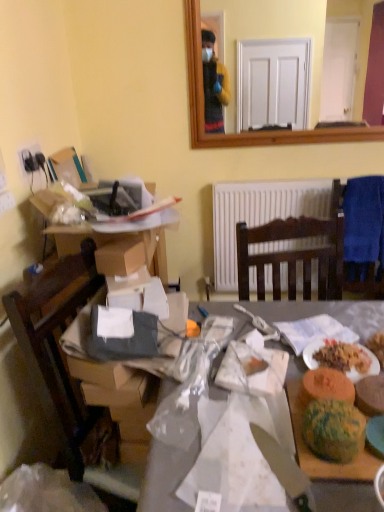
The height and width of the screenshot is (512, 384). What do you see at coordinates (285, 470) in the screenshot?
I see `silver metallic knife at center` at bounding box center [285, 470].

You are a GUI agent. You are given a task and a screenshot of the screen. Output one action in this format:
    pyautogui.click(x=<x>, y=<y>)
    Task: Click on the cardboard box at left, placed as the first desk when sorted from left to right
    Image resolution: width=384 pixels, height=512 pixels.
    Given the screenshot: What is the action you would take?
    point(116,247)

From the image's perspective, is white paper plate at lower right positioned above or below translucent plastic bag at center, acting as the second desk starting from the top?

white paper plate at lower right is situated higher than translucent plastic bag at center, acting as the second desk starting from the top, in the image.

Is point (318, 365) closer or farther from the camera than point (175, 502)?

Point (318, 365) is positioned farther from the camera compared to point (175, 502).

Visually, is white paper plate at lower right positioned to the left or to the right of translucent plastic bag at center, acting as the second desk starting from the top?

Clearly, white paper plate at lower right is on the right of translucent plastic bag at center, acting as the second desk starting from the top, in the image.

From a real-world perspective, is white paper plate at lower right on top of translucent plastic bag at center, acting as the second desk starting from the top?

Yes, from a real-world perspective, white paper plate at lower right is over translucent plastic bag at center, acting as the second desk starting from the top

Does point (345, 379) come behind point (219, 354)?

That is False.

Is green textured bread at lower right, the 1th food when ordered from left to right, shorter than translucent plastic bag at center, acting as the second desk starting from the top?

Yes, green textured bread at lower right, the 1th food when ordered from left to right, is shorter than translucent plastic bag at center, acting as the second desk starting from the top.

Is green textured bread at lower right, the 1th food when ordered from left to right, wider or thinner than translucent plastic bag at center, which is the 1th desk in right-to-left order?

green textured bread at lower right, the 1th food when ordered from left to right, is thinner than translucent plastic bag at center, which is the 1th desk in right-to-left order.

From the image's perspective, relative to translucent plastic bag at center, acting as the second desk starting from the top, is multicolored plastic watermelon at lower right above or below?

Based on their image positions, multicolored plastic watermelon at lower right is located above translucent plastic bag at center, acting as the second desk starting from the top.

How different are the orientations of multicolored plastic watermelon at lower right and translucent plastic bag at center, which is the 1th desk in right-to-left order, in degrees?

1.32 degrees separate the facing orientations of multicolored plastic watermelon at lower right and translucent plastic bag at center, which is the 1th desk in right-to-left order.

Which object is positioned more to the right, multicolored plastic watermelon at lower right or translucent plastic bag at center, the 2th desk viewed from the left?

multicolored plastic watermelon at lower right is more to the right.

Is multicolored plastic watermelon at lower right next to translucent plastic bag at center, the 2th desk viewed from the left?

No, multicolored plastic watermelon at lower right is not touching translucent plastic bag at center, the 2th desk viewed from the left.

Is point (312, 350) closer or farther from the camera than point (279, 481)?

Clearly, point (312, 350) is more distant from the camera than point (279, 481).

From the image's perspective, is white paper plate at lower right above silver metallic knife at center?

Yes, from the image's perspective, white paper plate at lower right is on top of silver metallic knife at center.

How many degrees apart are the facing directions of white paper plate at lower right and silver metallic knife at center?

The facing directions of white paper plate at lower right and silver metallic knife at center are 23.9 degrees apart.

Does white paper plate at lower right appear on the left side of silver metallic knife at center?

No.

From the multicolored plastic watermelon at lower right, count 3rd food to the right and point to it. Please provide its 2D coordinates.

[(334, 401)]

Is green textured cake at lower right, which is the third food from left to right, located within multicolored plastic watermelon at lower right?

Actually, green textured cake at lower right, which is the third food from left to right, is outside multicolored plastic watermelon at lower right.

Is multicolored plastic watermelon at lower right wider than green textured cake at lower right, the first food from the right?

In fact, multicolored plastic watermelon at lower right might be narrower than green textured cake at lower right, the first food from the right.

Considering the sizes of green textured bread at right, which is counted as the 2th food, starting from the right, and multicolored plastic watermelon at lower right in the image, is green textured bread at right, which is counted as the 2th food, starting from the right, taller or shorter than multicolored plastic watermelon at lower right?

Clearly, green textured bread at right, which is counted as the 2th food, starting from the right, is shorter compared to multicolored plastic watermelon at lower right.

Is green textured bread at right, which is counted as the 2th food, starting from the right, inside the boundaries of multicolored plastic watermelon at lower right, or outside?

green textured bread at right, which is counted as the 2th food, starting from the right, exists outside the volume of multicolored plastic watermelon at lower right.

In the image, is green textured bread at right, which is counted as the 2th food, starting from the right, positioned in front of or behind multicolored plastic watermelon at lower right?

Clearly, green textured bread at right, which is counted as the 2th food, starting from the right, is behind multicolored plastic watermelon at lower right.

From a real-world perspective, which object rests below the other?

white paper at center is physically lower.

Can you confirm if white paper at center is shorter than silver metallic knife at center?

Yes, white paper at center is shorter than silver metallic knife at center.

Based on the photo, is white paper at center bigger or smaller than silver metallic knife at center?

In the image, white paper at center appears to be larger than silver metallic knife at center.

Which is behind, point (228, 503) or point (305, 502)?

Positioned behind is point (228, 503).

Image resolution: width=384 pixels, height=512 pixels. Find the location of `desk that appears in front of the white paper plate at lower right`. desk that appears in front of the white paper plate at lower right is located at coordinates (167, 476).

Identify the location of food that is the 3rd one when counting upward from the translucent plastic bag at center, which is the 1th desk in right-to-left order (from the image's perspective). [327, 385].

Considering their positions, is cardboard box at left, which is counted as the 2th desk, starting from the bottom, positioned further to green textured cake at lower right, the first food from the right, than white paper plate at lower right?

cardboard box at left, which is counted as the 2th desk, starting from the bottom, is further to green textured cake at lower right, the first food from the right.

From the image, which object appears to be nearer to green textured bread at lower right, the 1th food when ordered from left to right, multicolored plastic watermelon at lower right or green textured cake at lower right, the first food from the right?

Based on the image, green textured cake at lower right, the first food from the right, appears to be nearer to green textured bread at lower right, the 1th food when ordered from left to right.

Looking at the image, which one is located further to translucent plastic bag at center, the 2th desk viewed from the left, green textured cake at lower right, the first food from the right, or multicolored plastic watermelon at lower right?

Among the two, multicolored plastic watermelon at lower right is located further to translucent plastic bag at center, the 2th desk viewed from the left.

Looking at the image, which one is located further to silver metallic knife at center, green textured bread at right, which is counted as the second food, starting from the left, or cardboard box at left, which is counted as the 2th desk, starting from the bottom?

Based on the image, cardboard box at left, which is counted as the 2th desk, starting from the bottom, appears to be further to silver metallic knife at center.

In the scene shown: Considering their positions, is multicolored plastic watermelon at lower right positioned closer to blue fabric chair at right than green textured bread at right, which is counted as the second food, starting from the left?

green textured bread at right, which is counted as the second food, starting from the left, is closer to blue fabric chair at right.

From the picture: Considering their positions, is blue fabric chair at right positioned closer to white paper at center than green textured cake at lower right, the first food from the right?

green textured cake at lower right, the first food from the right, is closer to white paper at center.

Looking at the image, which one is located closer to blue fabric chair at right, green textured bread at right, which is counted as the 2th food, starting from the right, or green textured bread at lower right, which is counted as the 3th food, starting from the right?

Based on the image, green textured bread at right, which is counted as the 2th food, starting from the right, appears to be nearer to blue fabric chair at right.

Looking at this image, looking at the image, which one is located closer to green textured bread at right, which is counted as the second food, starting from the left, green textured cake at lower right, which is the third food from left to right, or cardboard box at left, placed as the second desk when sorted from right to left?

green textured cake at lower right, which is the third food from left to right, is closer to green textured bread at right, which is counted as the second food, starting from the left.

The width and height of the screenshot is (384, 512). Identify the location of plate positioned between white paper at center and blue fabric chair at right from near to far. (368, 369).

Locate an element on the screen. food between green textured bread at lower right, the 1th food when ordered from left to right, and blue fabric chair at right, along the z-axis is located at coordinates (370, 395).

Identify the location of plate between white paper at center and green textured bread at right, which is counted as the 2th food, starting from the right, in the horizontal direction. (368, 369).

The height and width of the screenshot is (512, 384). In order to click on watermelon located between white paper at center and white paper plate at lower right in the depth direction in this screenshot , I will do `click(333, 430)`.